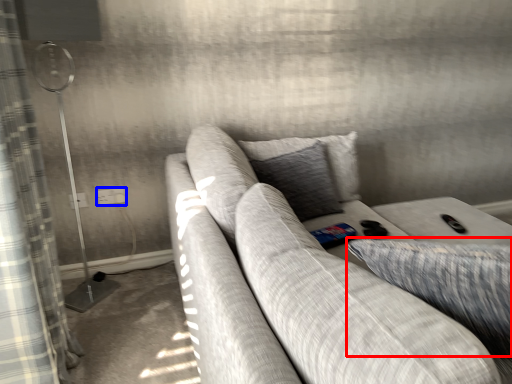
Question: Which point is further to the camera, pillow (highlighted by a red box) or electric outlet (highlighted by a blue box)?

Choices:
 (A) pillow
 (B) electric outlet

Answer: (B)